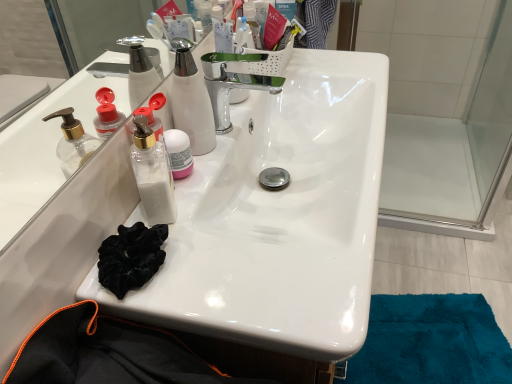
Question: In terms of size, does transparent plastic pump bottle at center, the first bottle positioned from the left, appear bigger or smaller than white matte jar at center, the 1th bottle when ordered from right to left?

Choices:
 (A) small
 (B) big

Answer: (B)

Question: From a real-world perspective, is transparent plastic pump bottle at center, the first bottle positioned from the left, positioned above or below white matte jar at center, the 1th bottle when ordered from right to left?

Choices:
 (A) above
 (B) below

Answer: (A)

Question: Considering their positions, is transparent plastic pump bottle at center, the first bottle positioned from the left, located in front of or behind white matte jar at center, the 1th bottle when ordered from right to left?

Choices:
 (A) front
 (B) behind

Answer: (A)

Question: Is point (179, 139) positioned closer to the camera than point (153, 182)?

Choices:
 (A) farther
 (B) closer

Answer: (A)

Question: Is white matte jar at center, the 1th bottle when ordered from right to left, situated inside transparent plastic pump bottle at center, the first bottle positioned from the left, or outside?

Choices:
 (A) inside
 (B) outside

Answer: (B)

Question: Considering the positions of white matte jar at center, the 1th bottle when ordered from right to left, and transparent plastic pump bottle at center, the first bottle positioned from the left, in the image, is white matte jar at center, the 1th bottle when ordered from right to left, wider or thinner than transparent plastic pump bottle at center, the first bottle positioned from the left,?

Choices:
 (A) wide
 (B) thin

Answer: (B)

Question: In terms of size, does white matte jar at center, which is the 2th bottle in left-to-right order, appear bigger or smaller than transparent plastic pump bottle at center, positioned as the 2th bottle in right-to-left order?

Choices:
 (A) small
 (B) big

Answer: (A)